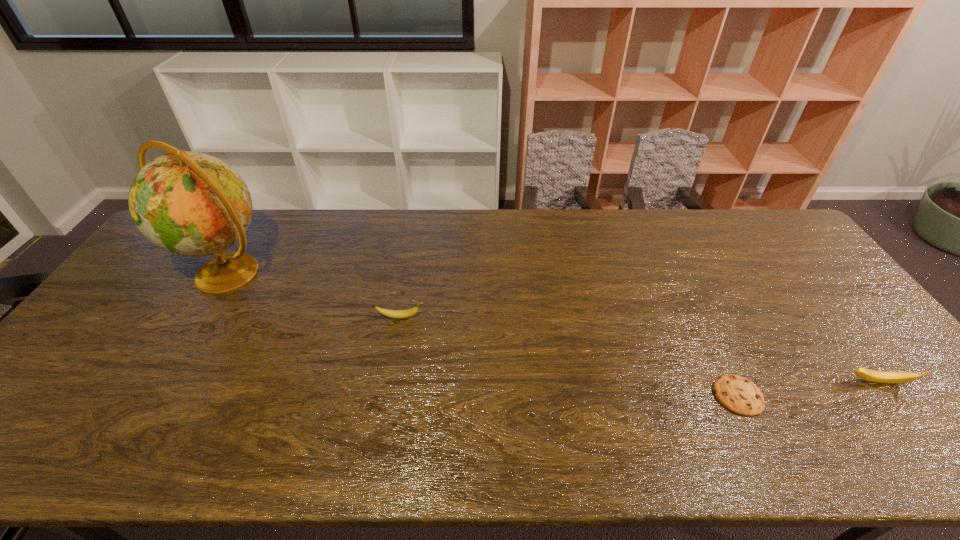
This screenshot has height=540, width=960. I want to click on empty location between the globe and the second farthest object, so coord(314,295).

At what (x,y) coordinates should I click in order to perform the action: click on free point between the left banana and the rightmost object. Please return your answer as a coordinate pair (x, y). Looking at the image, I should click on (639, 350).

Where is `unoccupied position between the rightmost object and the cookie`? unoccupied position between the rightmost object and the cookie is located at coordinates (807, 389).

Find the location of a particular element. The height and width of the screenshot is (540, 960). free area in between the right banana and the cookie is located at coordinates (807, 389).

This screenshot has width=960, height=540. I want to click on vacant space in between the shortest object and the tallest object, so click(482, 334).

Where is `free space that is in between the shortest object and the left banana`? free space that is in between the shortest object and the left banana is located at coordinates (569, 356).

The image size is (960, 540). Identify the location of free spot between the second object from left to right and the tallest object. (314, 295).

Locate an element on the screen. free space that is in between the leftmost object and the nearer banana is located at coordinates (553, 328).

Locate an element on the screen. The width and height of the screenshot is (960, 540). free space between the nearer banana and the leftmost object is located at coordinates (553, 328).

I want to click on unoccupied position between the nearer banana and the second farthest object, so click(x=639, y=350).